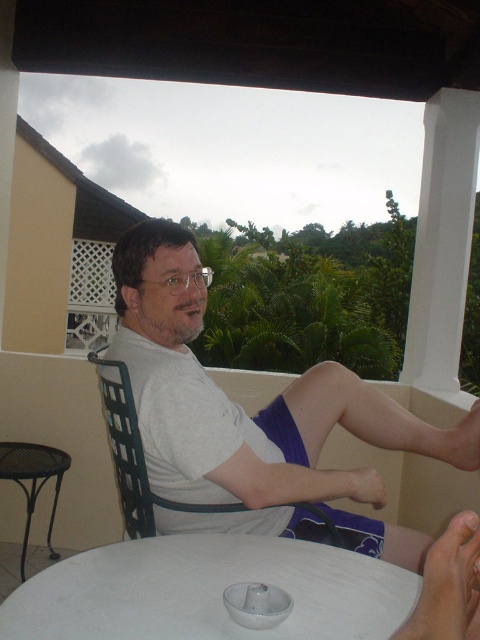
Question: Is white matte round table at center positioned behind black metal table at lower left?

Choices:
 (A) no
 (B) yes

Answer: (A)

Question: Which object is the closest to the black plastic chair at center?

Choices:
 (A) white matte round table at center
 (B) white cotton shirt at center
 (C) black metal table at lower left

Answer: (B)

Question: Which object is the farthest from the white cotton shirt at center?

Choices:
 (A) white matte round table at center
 (B) black plastic chair at center

Answer: (A)

Question: Among these objects, which one is farthest from the camera?

Choices:
 (A) white cotton shirt at center
 (B) white matte round table at center
 (C) black metal table at lower left

Answer: (C)

Question: Can you confirm if white matte round table at center is wider than black metal table at lower left?

Choices:
 (A) no
 (B) yes

Answer: (B)

Question: Is white cotton shirt at center smaller than black metal table at lower left?

Choices:
 (A) yes
 (B) no

Answer: (B)